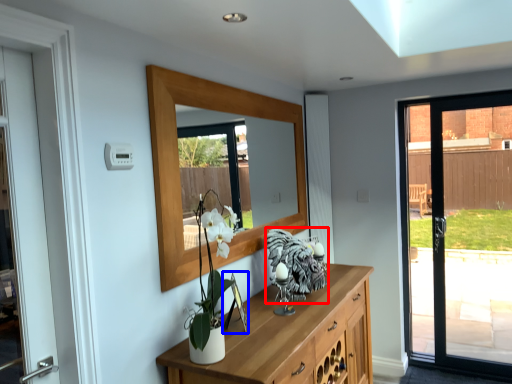
Question: Among these objects, which one is nearest to the camera, animal (highlighted by a red box) or picture frame (highlighted by a blue box)?

Choices:
 (A) animal
 (B) picture frame

Answer: (B)